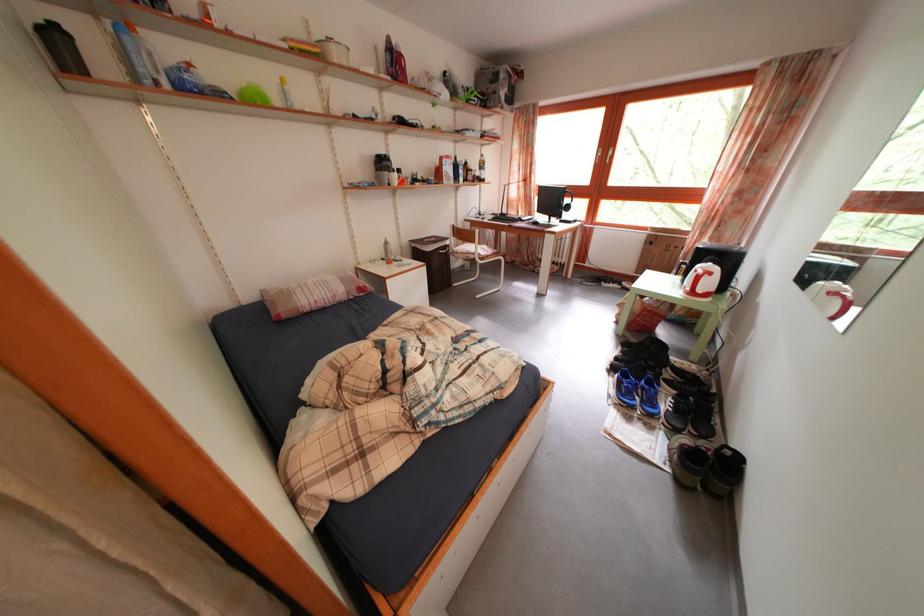
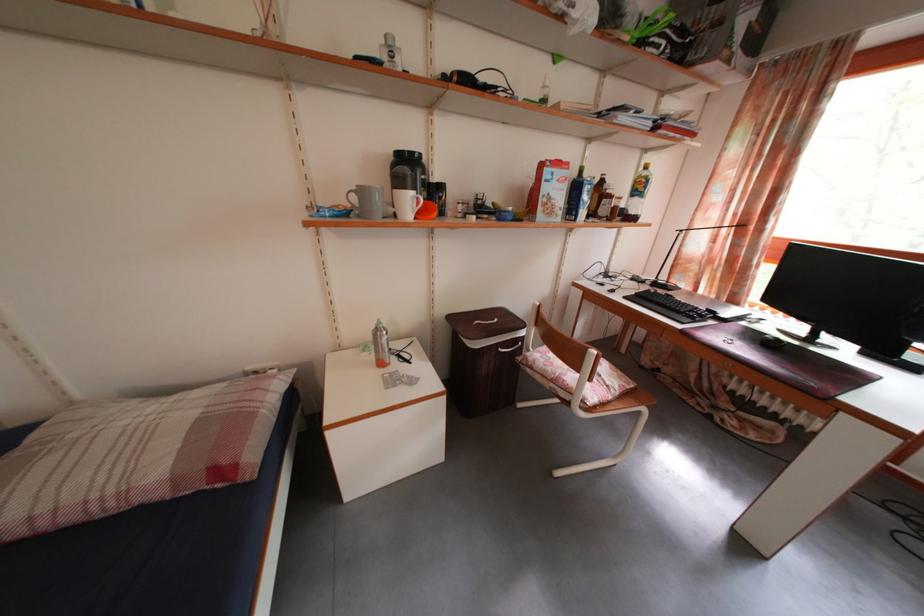
Find the pixel in the second image that matches [394,251] in the first image.

(384, 338)